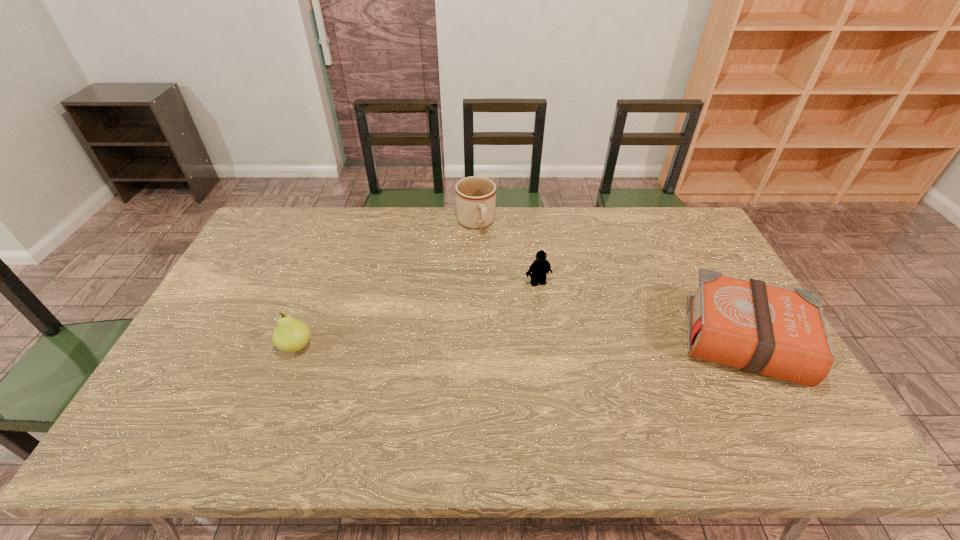
You are a GUI agent. You are given a task and a screenshot of the screen. Output one action in this format:
    pyautogui.click(x=<x>, y=<y>)
    Task: Click on the pear
    
    Given the screenshot: What is the action you would take?
    pyautogui.click(x=290, y=335)

This screenshot has height=540, width=960. I want to click on Bible, so click(760, 328).

Identify the location of mug. (475, 196).

This screenshot has width=960, height=540. I want to click on the second object from left to right, so click(475, 196).

At what (x,y) coordinates should I click in order to perform the action: click on the second farthest object. Please return your answer as a coordinate pair (x, y). Looking at the image, I should click on (540, 267).

What are the coordinates of `the third object from left to right` in the screenshot? It's located at (540, 267).

Locate an element on the screen. This screenshot has height=540, width=960. free location located 0.050m on the left of the leftmost object is located at coordinates (260, 346).

Image resolution: width=960 pixels, height=540 pixels. Find the location of `free space located 0.270m on the back of the rightmost object`. free space located 0.270m on the back of the rightmost object is located at coordinates (689, 242).

The image size is (960, 540). What are the coordinates of `vacant space located 0.070m on the side of the mug with the handle` in the screenshot? It's located at (486, 251).

This screenshot has height=540, width=960. I want to click on vacant space located on the side of the mug with the handle, so click(502, 291).